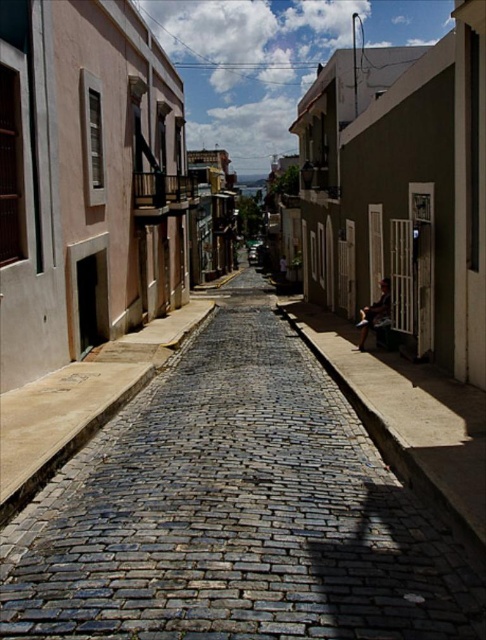
You are a street performer planning to set up a 2.5 meter wide stage in the middle of the cobblestone street at center. Considering the smooth stone bench at right is nearby, will the bench interfere with your setup?

The cobblestone street at center is wider than the smooth stone bench at right, so the bench will not interfere with the stage setup as long as it is placed in the center of the street.

You are a tourist walking on the cobblestone street at center and want to sit down. There is a smooth stone bench at right nearby. Which surface is larger in size to sit on?

The cobblestone street at center is bigger than smooth stone bench at right, so the cobblestone street at center is larger in size to sit on.

You are standing on the cobblestone street and want to walk towards the two points marked in the image. Which point would you reach first, point (327, 524) or point (479, 440)?

You would reach point (327, 524) first because it is closer to the camera than point (479, 440).